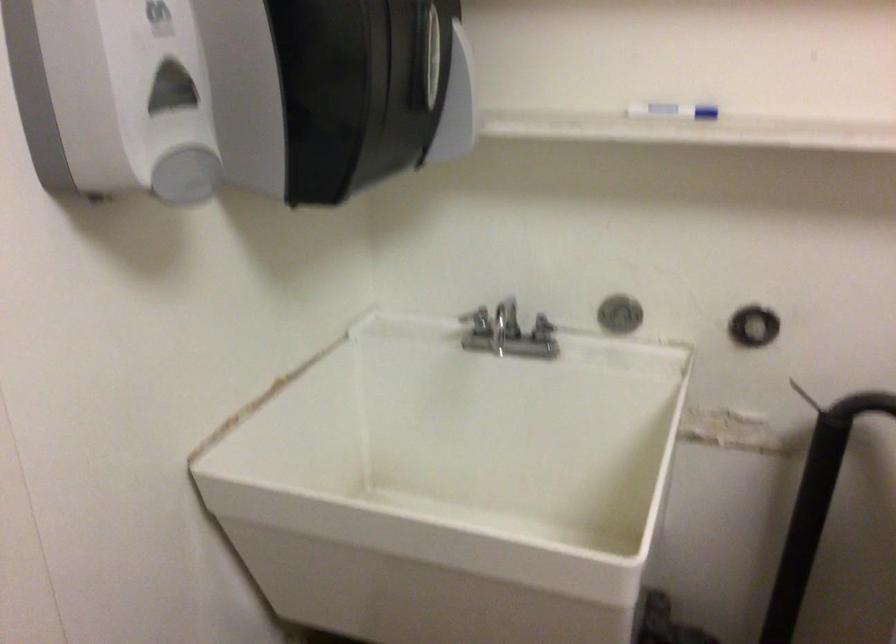
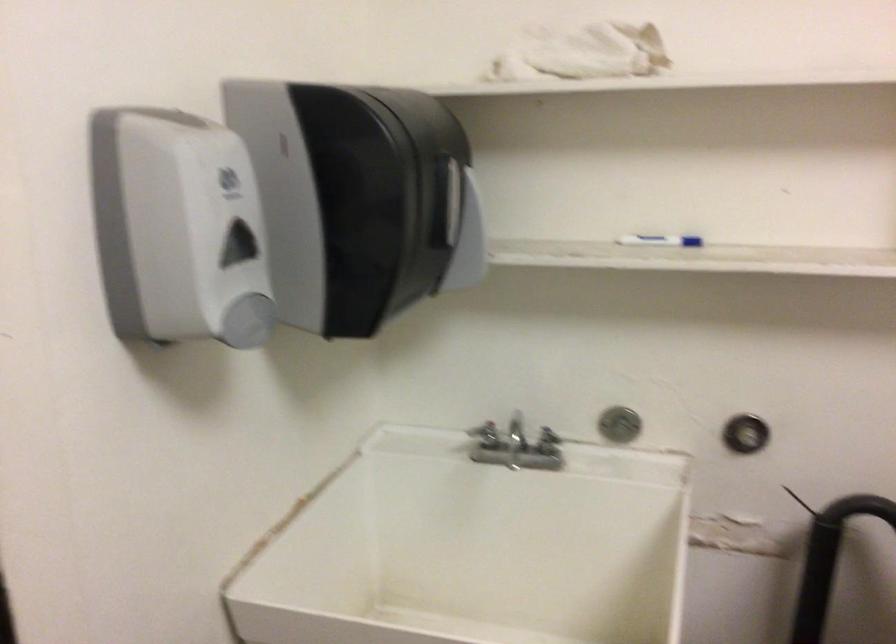
Question: How did the camera likely rotate?

Choices:
 (A) Left
 (B) Right
 (C) Up
 (D) Down

Answer: (C)